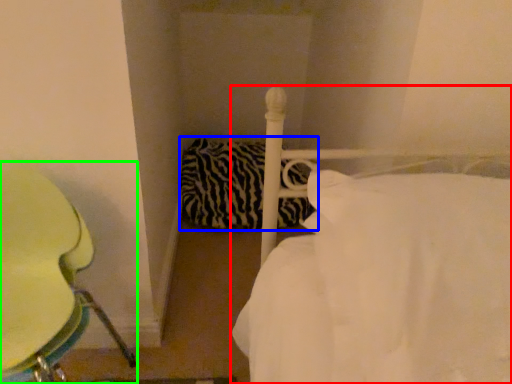
Question: Which is farther away from bed (highlighted by a red box)? pillow (highlighted by a blue box) or furniture (highlighted by a green box)?

Choices:
 (A) pillow
 (B) furniture

Answer: (A)